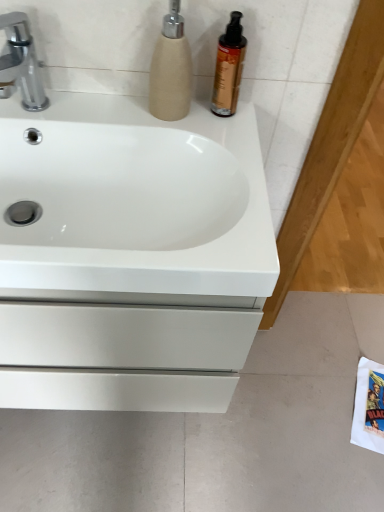
Find the location of a particular element. Image resolution: width=384 pixels, height=512 pixels. vacant area located to the right-hand side of silver metallic faucet at upper left is located at coordinates pos(98,110).